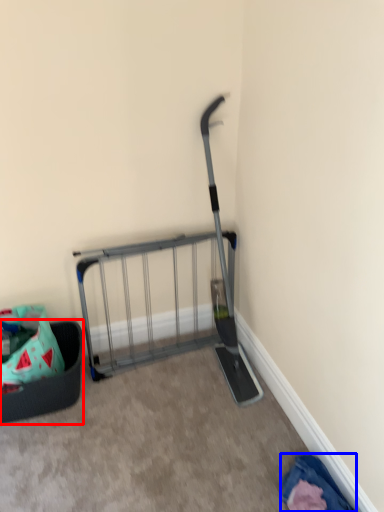
Question: Which point is closer to the camera, furniture (highlighted by a red box) or clothing (highlighted by a blue box)?

Choices:
 (A) furniture
 (B) clothing

Answer: (B)